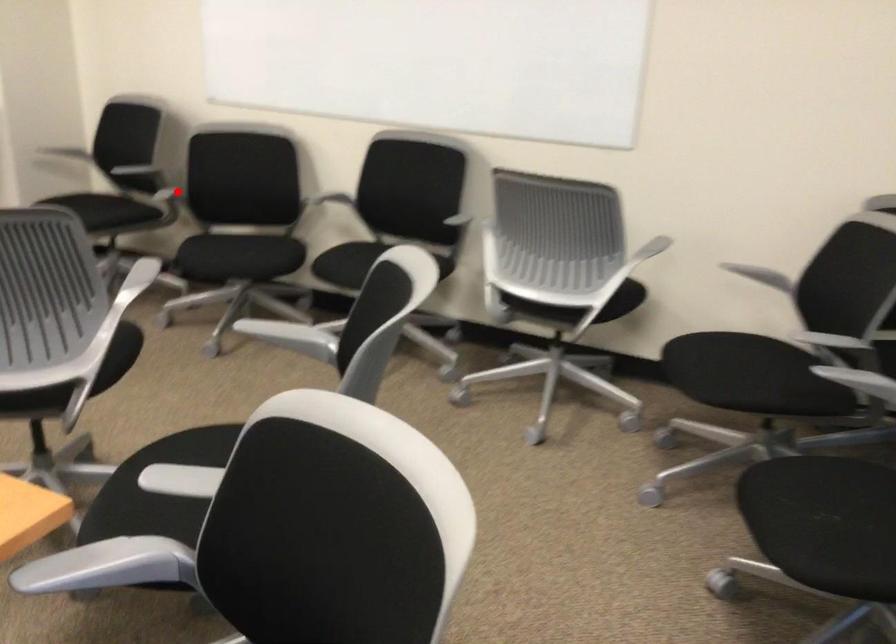
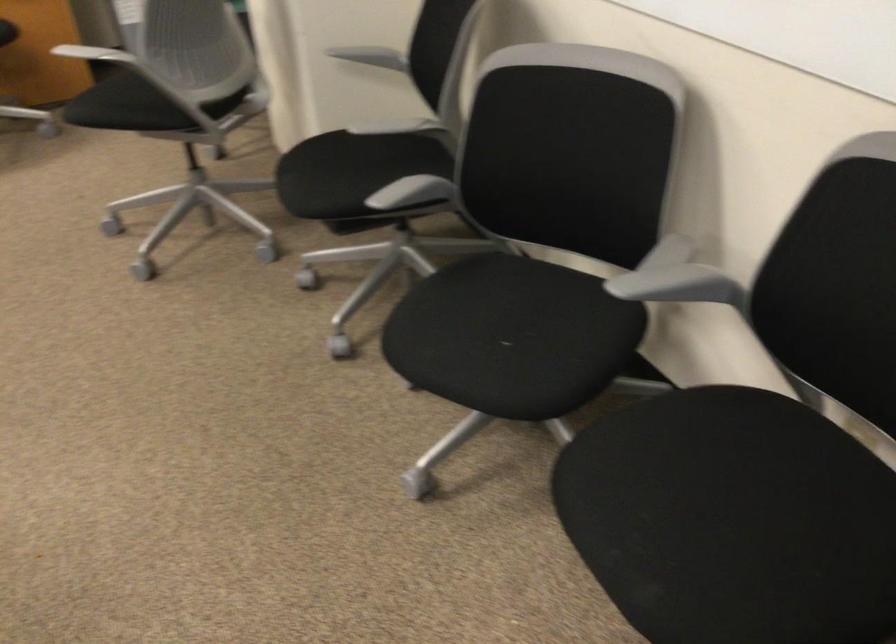
Find the pixel in the second image that matches the highlighted location in the first image.

(412, 193)